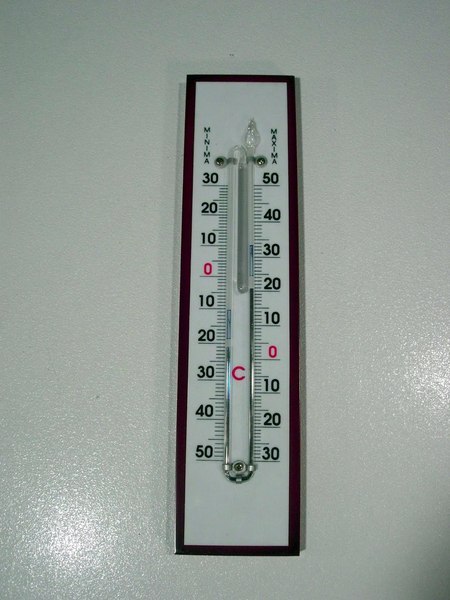
Find the location of a particular element. thermometer is located at coordinates (230, 507).